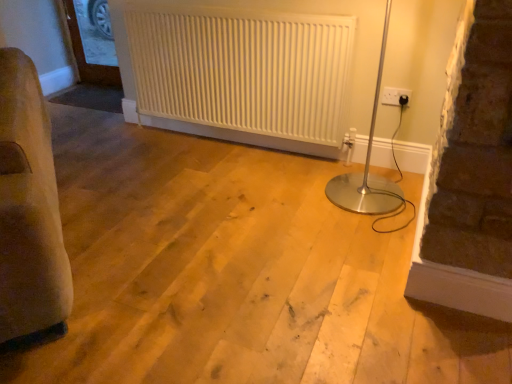
What do you see at coordinates (395, 96) in the screenshot?
I see `white plastic electric outlet at upper right` at bounding box center [395, 96].

At what (x,y) coordinates should I click in order to perform the action: click on white plastic electric outlet at upper right. Please return your answer as a coordinate pair (x, y). This screenshot has height=384, width=512. Looking at the image, I should click on (395, 96).

Measure the distance between white textured radiator at center and camera.

white textured radiator at center is 6.92 feet from camera.

You are a GUI agent. You are given a task and a screenshot of the screen. Output one action in this format:
    pyautogui.click(x=<x>, y=<y>)
    Task: Click on the white plastic electric outlet at upper right
    Image resolution: width=512 pixels, height=384 pixels.
    Given the screenshot: What is the action you would take?
    pyautogui.click(x=395, y=96)

Which is closer to the camera, (167, 48) or (393, 98)?

Point (167, 48) appears to be farther away from the viewer than point (393, 98).

Measure the distance from white textured radiator at center to white plastic electric outlet at upper right.

white textured radiator at center and white plastic electric outlet at upper right are 32.78 inches apart.

Considering the relative positions of white textured radiator at center and white plastic electric outlet at upper right in the image provided, is white textured radiator at center to the left or to the right of white plastic electric outlet at upper right?

From the image, it's evident that white textured radiator at center is to the left of white plastic electric outlet at upper right.

Can you tell me how much white textured radiator at center and white plastic electric outlet at upper right differ in facing direction?

0.713 degrees.

From the image's perspective, would you say clear glass door at upper left is shown under white plastic electric outlet at upper right?

No.

Can you confirm if clear glass door at upper left is thinner than white plastic electric outlet at upper right?

No, clear glass door at upper left is not thinner than white plastic electric outlet at upper right.

From a real-world perspective, who is located lower, clear glass door at upper left or white plastic electric outlet at upper right?

clear glass door at upper left is physically lower.

Is point (402, 101) less distant than point (81, 2)?

Yes.

In the image, is white plastic electric outlet at upper right positioned in front of or behind clear glass door at upper left?

white plastic electric outlet at upper right is in front of clear glass door at upper left.

Considering the relative sizes of white plastic electric outlet at upper right and clear glass door at upper left in the image provided, is white plastic electric outlet at upper right thinner than clear glass door at upper left?

Yes, white plastic electric outlet at upper right is thinner than clear glass door at upper left.

Considering the relative sizes of white plastic electric outlet at upper right and clear glass door at upper left in the image provided, is white plastic electric outlet at upper right shorter than clear glass door at upper left?

Correct, white plastic electric outlet at upper right is not as tall as clear glass door at upper left.

From the image's perspective, does white textured radiator at center appear higher than clear glass door at upper left?

No, from the image's perspective, white textured radiator at center is not on top of clear glass door at upper left.

Which of these two, white textured radiator at center or clear glass door at upper left, is wider?

white textured radiator at center is wider.

Is white textured radiator at center directly adjacent to clear glass door at upper left?

white textured radiator at center and clear glass door at upper left are not in contact.

Is white plastic electric outlet at upper right thinner than white textured radiator at center?

Indeed, white plastic electric outlet at upper right has a lesser width compared to white textured radiator at center.

In the scene shown: Which is correct: white plastic electric outlet at upper right is inside white textured radiator at center, or outside of it?

white plastic electric outlet at upper right is located beyond the bounds of white textured radiator at center.

How many degrees apart are the facing directions of white plastic electric outlet at upper right and white textured radiator at center?

0.713 degrees.

Could you tell me if clear glass door at upper left is turned towards white textured radiator at center?

No, clear glass door at upper left is not facing towards white textured radiator at center.

Where is `radiator above the clear glass door at upper left (from a real-world perspective)`? radiator above the clear glass door at upper left (from a real-world perspective) is located at coordinates (244, 73).

Looking at their sizes, would you say clear glass door at upper left is wider or thinner than white textured radiator at center?

clear glass door at upper left is thinner than white textured radiator at center.

From a real-world perspective, who is located higher, clear glass door at upper left or white textured radiator at center?

white textured radiator at center, from a real-world perspective.

Locate an element on the screen. The width and height of the screenshot is (512, 384). radiator that appears in front of the white plastic electric outlet at upper right is located at coordinates (244, 73).

I want to click on electric outlet below the clear glass door at upper left (from the image's perspective), so click(x=395, y=96).

When comparing their distances from clear glass door at upper left, does white plastic electric outlet at upper right or white textured radiator at center seem closer?

white textured radiator at center is closer to clear glass door at upper left.

When comparing their distances from white plastic electric outlet at upper right, does clear glass door at upper left or white textured radiator at center seem closer?

white textured radiator at center lies closer to white plastic electric outlet at upper right than the other object.

Considering their positions, is clear glass door at upper left positioned closer to white textured radiator at center than white plastic electric outlet at upper right?

white plastic electric outlet at upper right is positioned closer to the anchor white textured radiator at center.

Considering their positions, is white plastic electric outlet at upper right positioned further to white textured radiator at center than clear glass door at upper left?

clear glass door at upper left is positioned further to the anchor white textured radiator at center.

Looking at the image, which one is located closer to clear glass door at upper left, white textured radiator at center or white plastic electric outlet at upper right?

white textured radiator at center lies closer to clear glass door at upper left than the other object.

Considering their positions, is white textured radiator at center positioned closer to white plastic electric outlet at upper right than clear glass door at upper left?

The object closer to white plastic electric outlet at upper right is white textured radiator at center.

In order to click on radiator between clear glass door at upper left and white plastic electric outlet at upper right from left to right in this screenshot , I will do `click(244, 73)`.